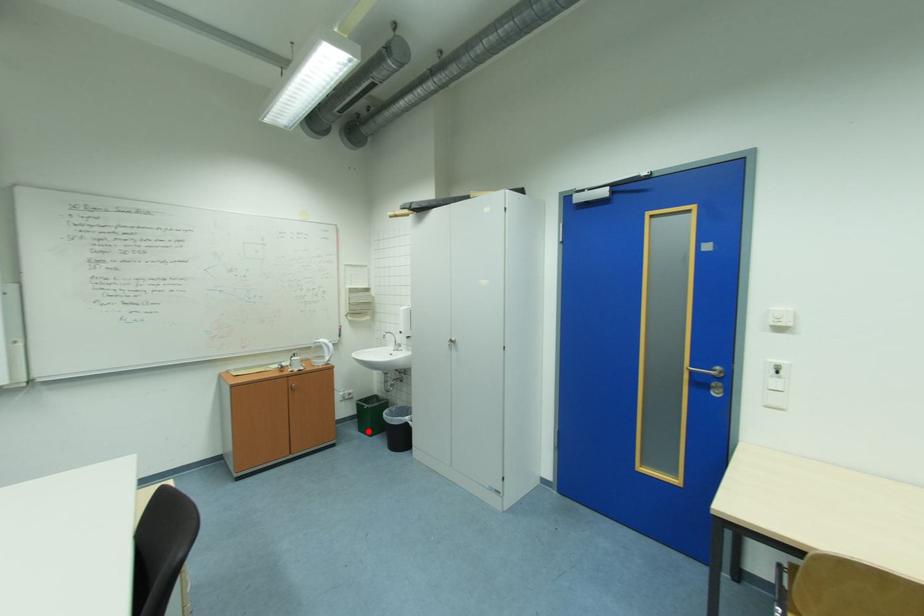
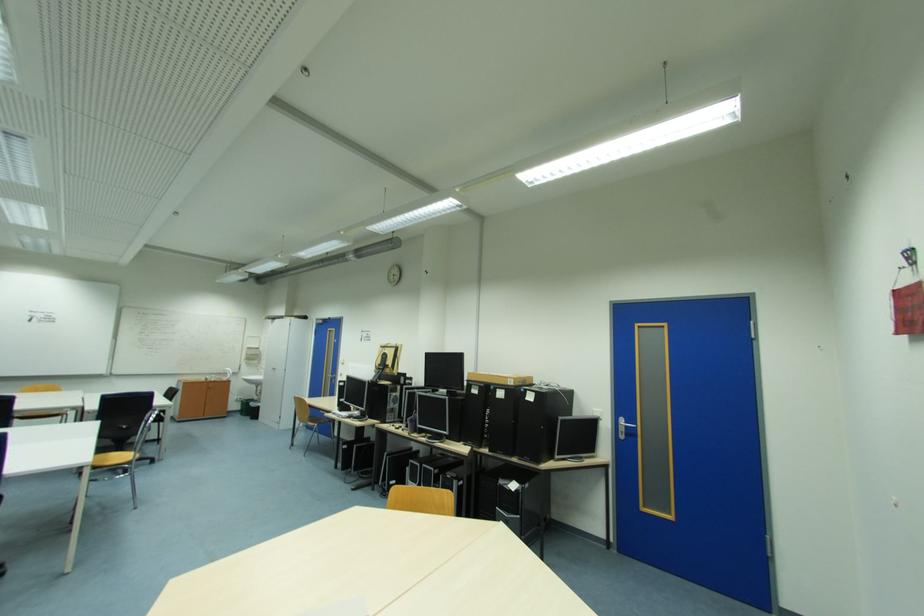
Find the pixel in the second image that matches the highlighted location in the first image.

(249, 416)